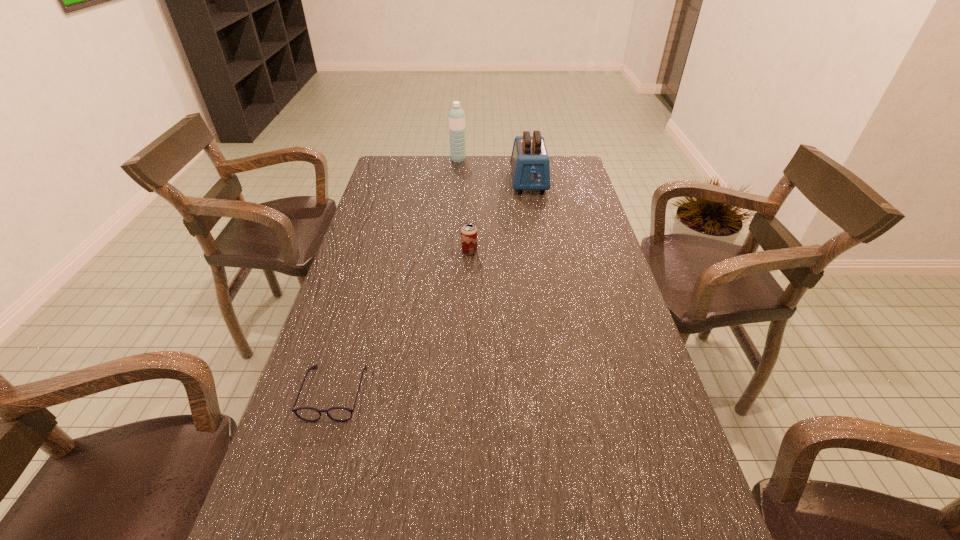
Locate an element on the screen. The width and height of the screenshot is (960, 540). the second object from left to right is located at coordinates (456, 116).

Where is `the tallest object`? Image resolution: width=960 pixels, height=540 pixels. the tallest object is located at coordinates (456, 116).

Find the location of a particular element. the rightmost object is located at coordinates (530, 166).

This screenshot has width=960, height=540. I want to click on the third shortest object, so click(530, 166).

Image resolution: width=960 pixels, height=540 pixels. Find the location of `the third tallest object`. the third tallest object is located at coordinates (468, 231).

The height and width of the screenshot is (540, 960). Identify the location of the third farthest object. (468, 231).

Locate an element on the screen. spectacles is located at coordinates (340, 414).

Identify the location of the leftmost object. (340, 414).

This screenshot has height=540, width=960. I want to click on vacant space situated on the front of the water bottle, so click(x=456, y=182).

Image resolution: width=960 pixels, height=540 pixels. Identify the location of vacant space situated on the front-facing side of the third nearest object. (533, 203).